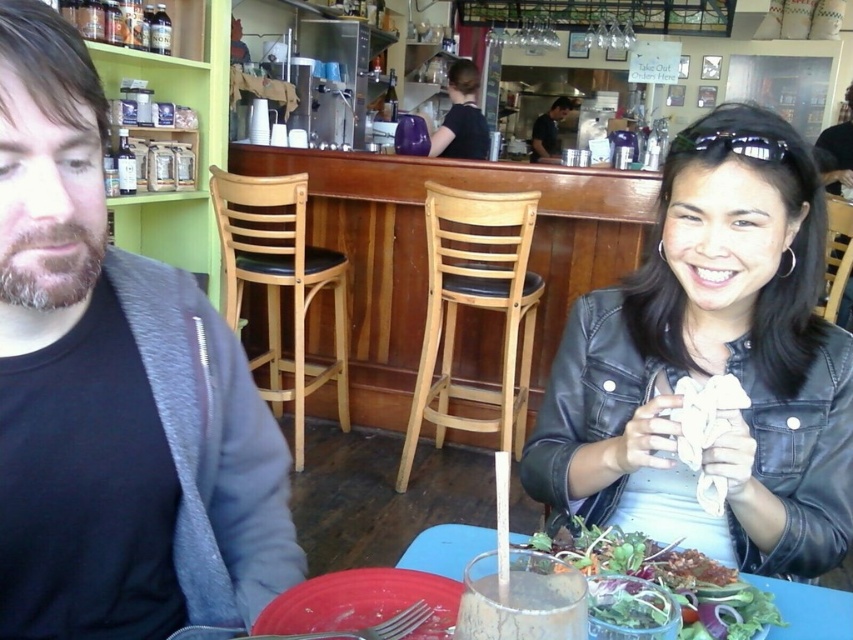
What is located at the coordinate point (x=114, y=392) in the image?

The black matte jacket at left is located at the coordinate point (x=114, y=392).

You are a delivery person who needs to place a small package between the black matte jacket at left and the black reflective sunglasses at upper center. The package measures 50 centimeters in length. Will it fit in the space between them?

The distance between the black matte jacket at left and the black reflective sunglasses at upper center is 74.31 centimeters. Since the package is only 50 centimeters long, it will fit comfortably within the available space.

You are a customer in the cafe and want to order a fresh green salad. The menu says that the salad is placed exactly at point (669, 579). Where should you look to find it?

The fresh green salad is located at point (669, 579), which is at the lower center of the image.